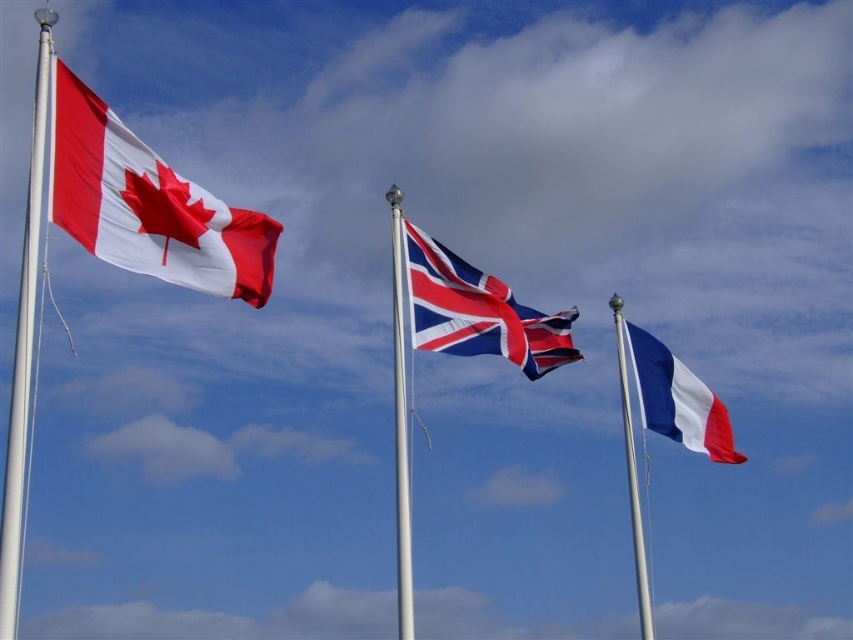
You are standing in front of the Canadian flag and want to take a photo of the point at coordinates point (506, 353) and point (28, 378). Which point should you focus on first to ensure both are in focus?

You should focus on point (506, 353) first because it is closer to you than point (28, 378), ensuring both points will be in focus when using the camera.

You are standing in front of three waving national flags. There are two points marked in the image. One is at coordinates point (397, 326) and the other is at point (637, 560). Which of these two points is nearer to you?

Point (397, 326) is closer to the camera than point (637, 560).

You are a photographer trying to capture the national flags in the scene. You notice the textured fabric flag at center and the white metallic pole at left. Which object is wider when viewed from your position?

The textured fabric flag at center is wider than the white metallic pole at left.